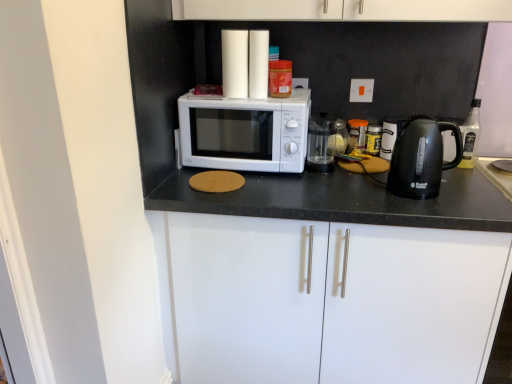
In order to click on white matte cabinet at center, which is the second cabinetry from top to bottom in this screenshot , I will do `click(324, 300)`.

Describe the element at coordinates (324, 300) in the screenshot. Image resolution: width=512 pixels, height=384 pixels. I see `white matte cabinet at center, which is the second cabinetry from top to bottom` at that location.

This screenshot has width=512, height=384. What do you see at coordinates (421, 157) in the screenshot? I see `black plastic kettle at right` at bounding box center [421, 157].

Describe the element at coordinates (245, 132) in the screenshot. This screenshot has height=384, width=512. I see `white matte microwave at center` at that location.

What is the approximate width of white matte cabinet doors at upper center, the second cabinetry positioned from the bottom?

The width of white matte cabinet doors at upper center, the second cabinetry positioned from the bottom, is 12.83 inches.

The height and width of the screenshot is (384, 512). What do you see at coordinates (470, 134) in the screenshot?
I see `black plastic bottle at right` at bounding box center [470, 134].

Find the location of `transparent glass coffee maker at center`. transparent glass coffee maker at center is located at coordinates (325, 142).

Which object is wider, transparent glass coffee maker at center or white matte microwave at center?

white matte microwave at center.

Does point (320, 122) come in front of point (203, 152)?

No, it is behind (203, 152).

Is transparent glass coffee maker at center positioned with its back to white matte microwave at center?

No, transparent glass coffee maker at center's orientation is not away from white matte microwave at center.

From the image's perspective, is transparent glass coffee maker at center positioned above or below white matte microwave at center?

Clearly, from the image's perspective, transparent glass coffee maker at center is below white matte microwave at center.

Considering the relative positions of white matte cabinet at center, which is the second cabinetry from top to bottom, and transparent glass coffee maker at center in the image provided, is white matte cabinet at center, which is the second cabinetry from top to bottom, to the right of transparent glass coffee maker at center from the viewer's perspective?

Yes.

Locate an element on the screen. the 2nd cabinetry in front of the transparent glass coffee maker at center is located at coordinates click(324, 300).

Considering the positions of objects white matte cabinet at center, which is the second cabinetry from top to bottom, and transparent glass coffee maker at center in the image provided, who is behind, white matte cabinet at center, which is the second cabinetry from top to bottom, or transparent glass coffee maker at center?

transparent glass coffee maker at center.

From the image's perspective, who appears lower, transparent glass coffee maker at center or white matte cabinet doors at upper center, positioned as the first cabinetry in top-to-bottom order?

transparent glass coffee maker at center is shown below in the image.

From the picture: Is transparent glass coffee maker at center not within white matte cabinet doors at upper center, the second cabinetry positioned from the bottom?

Answer: That's correct, transparent glass coffee maker at center is outside of white matte cabinet doors at upper center, the second cabinetry positioned from the bottom.

How many degrees apart are the facing directions of transparent glass coffee maker at center and white matte cabinet doors at upper center, the second cabinetry positioned from the bottom?

There is a 1.6-degree angle between the facing directions of transparent glass coffee maker at center and white matte cabinet doors at upper center, the second cabinetry positioned from the bottom.

Which object is further away from the camera, transparent glass coffee maker at center or white matte cabinet doors at upper center, the second cabinetry positioned from the bottom?

transparent glass coffee maker at center is behind.

From a real-world perspective, is white matte cabinet at center, which is the second cabinetry from top to bottom, below black plastic kettle at right?

Correct, in the physical world, white matte cabinet at center, which is the second cabinetry from top to bottom, is lower than black plastic kettle at right.

Can you confirm if white matte cabinet at center, which is the 1th cabinetry from bottom to top, is taller than black plastic kettle at right?

Yes.

Which object is thinner, white matte cabinet at center, which is the 1th cabinetry from bottom to top, or black plastic kettle at right?

With smaller width is black plastic kettle at right.

Is white matte cabinet at center, which is the second cabinetry from top to bottom, oriented away from black plastic kettle at right?

No, black plastic kettle at right is not at the back of white matte cabinet at center, which is the second cabinetry from top to bottom.

Where is `cabinetry above the black plastic kettle at right (from a real-world perspective)`? The width and height of the screenshot is (512, 384). cabinetry above the black plastic kettle at right (from a real-world perspective) is located at coordinates (344, 10).

Does black plastic kettle at right have a greater width compared to white matte cabinet doors at upper center, positioned as the first cabinetry in top-to-bottom order?

No.

Does point (417, 146) come closer to viewer compared to point (302, 0)?

That is True.

How different are the orientations of black plastic kettle at right and white matte cabinet doors at upper center, the second cabinetry positioned from the bottom, in degrees?

They differ by 4.41 degrees in their facing directions.

Is white matte microwave at center in front of or behind black plastic kettle at right in the image?

Clearly, white matte microwave at center is behind black plastic kettle at right.

Considering the positions of point (274, 109) and point (453, 165), is point (274, 109) closer or farther from the camera than point (453, 165)?

Point (274, 109) appears to be closer to the viewer than point (453, 165).

From the image's perspective, between white matte microwave at center and black plastic kettle at right, which one is located above?

white matte microwave at center is shown above in the image.

Is white matte microwave at center aimed at black plastic kettle at right?

No, white matte microwave at center is not oriented towards black plastic kettle at right.

Starting from the black plastic bottle at right, which cabinetry is the 1st one to the left? Please provide its 2D coordinates.

[(324, 300)]

Could you tell me if white matte cabinet at center, which is the 1th cabinetry from bottom to top, is turned towards black plastic bottle at right?

No, white matte cabinet at center, which is the 1th cabinetry from bottom to top, does not turn towards black plastic bottle at right.

Which object is positioned more to the left, white matte cabinet at center, which is the second cabinetry from top to bottom, or black plastic bottle at right?

white matte cabinet at center, which is the second cabinetry from top to bottom, is more to the left.

Is white matte cabinet at center, which is the 1th cabinetry from bottom to top, further to camera compared to black plastic bottle at right?

No, white matte cabinet at center, which is the 1th cabinetry from bottom to top, is in front of black plastic bottle at right.

The width and height of the screenshot is (512, 384). I want to click on appliance lying below the white matte microwave at center (from the image's perspective), so click(x=325, y=142).

The width and height of the screenshot is (512, 384). Find the location of `appliance behind the white matte cabinet at center, which is the second cabinetry from top to bottom`. appliance behind the white matte cabinet at center, which is the second cabinetry from top to bottom is located at coordinates pyautogui.click(x=325, y=142).

Considering their positions, is transparent glass coffee maker at center positioned closer to black plastic kettle at right than black plastic bottle at right?

transparent glass coffee maker at center is positioned closer to the anchor black plastic kettle at right.

Looking at the image, which one is located further to black plastic kettle at right, transparent glass coffee maker at center or white matte cabinet at center, which is the second cabinetry from top to bottom?

The object further to black plastic kettle at right is white matte cabinet at center, which is the second cabinetry from top to bottom.

Considering their positions, is black plastic kettle at right positioned closer to white matte cabinet at center, which is the 1th cabinetry from bottom to top, than black plastic bottle at right?

Based on the image, black plastic kettle at right appears to be nearer to white matte cabinet at center, which is the 1th cabinetry from bottom to top.

Which object lies nearer to the anchor point black plastic kettle at right, black plastic bottle at right or transparent glass coffee maker at center?

Based on the image, transparent glass coffee maker at center appears to be nearer to black plastic kettle at right.

Considering their positions, is transparent glass coffee maker at center positioned closer to white matte microwave at center than black plastic kettle at right?

The object closer to white matte microwave at center is transparent glass coffee maker at center.

Looking at the image, which one is located further to transparent glass coffee maker at center, white matte cabinet at center, which is the second cabinetry from top to bottom, or black plastic bottle at right?

Among the two, white matte cabinet at center, which is the second cabinetry from top to bottom, is located further to transparent glass coffee maker at center.

Estimate the real-world distances between objects in this image. Which object is closer to white matte cabinet at center, which is the 1th cabinetry from bottom to top, black plastic bottle at right or transparent glass coffee maker at center?

transparent glass coffee maker at center is positioned closer to the anchor white matte cabinet at center, which is the 1th cabinetry from bottom to top.

When comparing their distances from white matte cabinet doors at upper center, the second cabinetry positioned from the bottom, does black plastic bottle at right or transparent glass coffee maker at center seem further?

black plastic bottle at right.

The image size is (512, 384). I want to click on microwave oven between white matte cabinet doors at upper center, positioned as the first cabinetry in top-to-bottom order, and white matte cabinet at center, which is the second cabinetry from top to bottom, from top to bottom, so click(x=245, y=132).

The height and width of the screenshot is (384, 512). In order to click on bottle that lies between white matte cabinet doors at upper center, the second cabinetry positioned from the bottom, and black plastic kettle at right from top to bottom in this screenshot , I will do click(x=470, y=134).

I want to click on appliance between white matte microwave at center and black plastic bottle at right from left to right, so click(325, 142).

Locate an element on the screen. bottle between white matte cabinet doors at upper center, positioned as the first cabinetry in top-to-bottom order, and white matte cabinet at center, which is the second cabinetry from top to bottom, in the vertical direction is located at coordinates (470, 134).